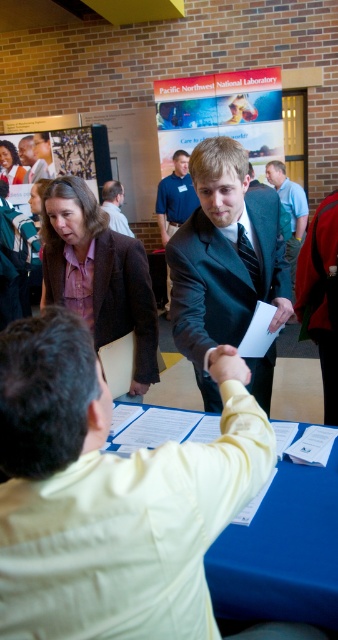
Can you confirm if yellow fabric shirt at center is thinner than matte plastic poster at upper left?

Indeed, yellow fabric shirt at center has a lesser width compared to matte plastic poster at upper left.

Does yellow fabric shirt at center have a smaller size compared to matte plastic poster at upper left?

Yes, yellow fabric shirt at center is smaller than matte plastic poster at upper left.

Between point (52, 620) and point (33, 138), which one is positioned in front?

Point (52, 620)

Where is `yellow fabric shirt at center`? The height and width of the screenshot is (640, 338). yellow fabric shirt at center is located at coordinates (108, 499).

Does shiny black suit at center have a greater width compared to matte black suit at center?

Indeed, shiny black suit at center has a greater width compared to matte black suit at center.

Identify the location of shiny black suit at center. (225, 260).

This screenshot has height=640, width=338. I want to click on shiny black suit at center, so click(225, 260).

Is matte white banner at upper center closer to camera compared to blue denim shirt at center?

Yes, it is in front of blue denim shirt at center.

Who is more distant from viewer, (x=282, y=145) or (x=274, y=168)?

Point (x=274, y=168)

Identify the location of matte white banner at upper center. The width and height of the screenshot is (338, 640). (221, 113).